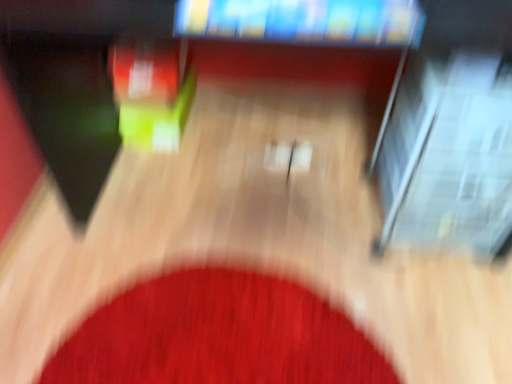
Question: Considering the relative positions of red carpet at center and matte plastic television at upper center in the image provided, is red carpet at center to the left of matte plastic television at upper center from the viewer's perspective?

Choices:
 (A) no
 (B) yes

Answer: (B)

Question: Does red carpet at center turn towards matte plastic television at upper center?

Choices:
 (A) yes
 (B) no

Answer: (B)

Question: Can you confirm if red carpet at center is smaller than matte plastic television at upper center?

Choices:
 (A) yes
 (B) no

Answer: (B)

Question: Considering the relative sizes of red carpet at center and matte plastic television at upper center in the image provided, is red carpet at center taller than matte plastic television at upper center?

Choices:
 (A) no
 (B) yes

Answer: (B)

Question: Is red carpet at center positioned before matte plastic television at upper center?

Choices:
 (A) no
 (B) yes

Answer: (A)

Question: Can you confirm if red carpet at center is positioned to the right of matte plastic television at upper center?

Choices:
 (A) no
 (B) yes

Answer: (A)

Question: Can you see matte plastic television at upper center touching red carpet at center?

Choices:
 (A) yes
 (B) no

Answer: (B)

Question: From a real-world perspective, does matte plastic television at upper center stand above red carpet at center?

Choices:
 (A) yes
 (B) no

Answer: (A)

Question: Is there a large distance between matte plastic television at upper center and red carpet at center?

Choices:
 (A) yes
 (B) no

Answer: (B)

Question: Does matte plastic television at upper center have a smaller size compared to red carpet at center?

Choices:
 (A) yes
 (B) no

Answer: (A)

Question: Is red carpet at center at the back of matte plastic television at upper center?

Choices:
 (A) yes
 (B) no

Answer: (B)

Question: Is matte plastic television at upper center wider than red carpet at center?

Choices:
 (A) no
 (B) yes

Answer: (A)

Question: From the image's perspective, is red carpet at center located above or below matte plastic television at upper center?

Choices:
 (A) below
 (B) above

Answer: (A)